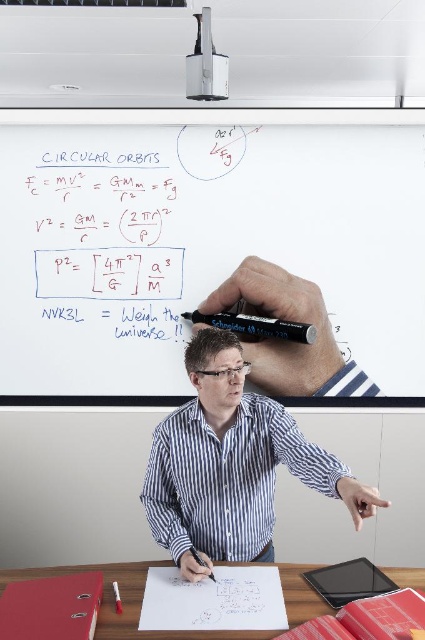
In the scene shown: Who is taller, black matte marker at center or black matte marker at upper center?

black matte marker at center

Is point (294, 324) positioned after point (359, 493)?

That is True.

Is point (309, 333) positioned before point (348, 496)?

No, it is behind (348, 496).

Locate an element on the screen. black matte marker at center is located at coordinates (255, 326).

How distant is black marker at upper center from black matte marker at upper center?

black marker at upper center and black matte marker at upper center are 4.96 feet apart.

Is black marker at upper center shorter than black matte marker at upper center?

No.

Which is in front, point (252, 292) or point (368, 509)?

Point (368, 509) is in front.

You are a GUI agent. You are given a task and a screenshot of the screen. Output one action in this format:
    pyautogui.click(x=<x>, y=<y>)
    Task: Click on the black marker at upper center
    Image resolution: width=425 pixels, height=640 pixels.
    Given the screenshot: What is the action you would take?
    tap(280, 320)

Is point (129, 337) in front of point (320, 312)?

No.

Which of these two, whiteboard at upper center or black marker at upper center, stands taller?

Standing taller between the two is whiteboard at upper center.

The width and height of the screenshot is (425, 640). I want to click on whiteboard at upper center, so click(201, 241).

The height and width of the screenshot is (640, 425). What are the coordinates of `whiteboard at upper center` in the screenshot? It's located at (201, 241).